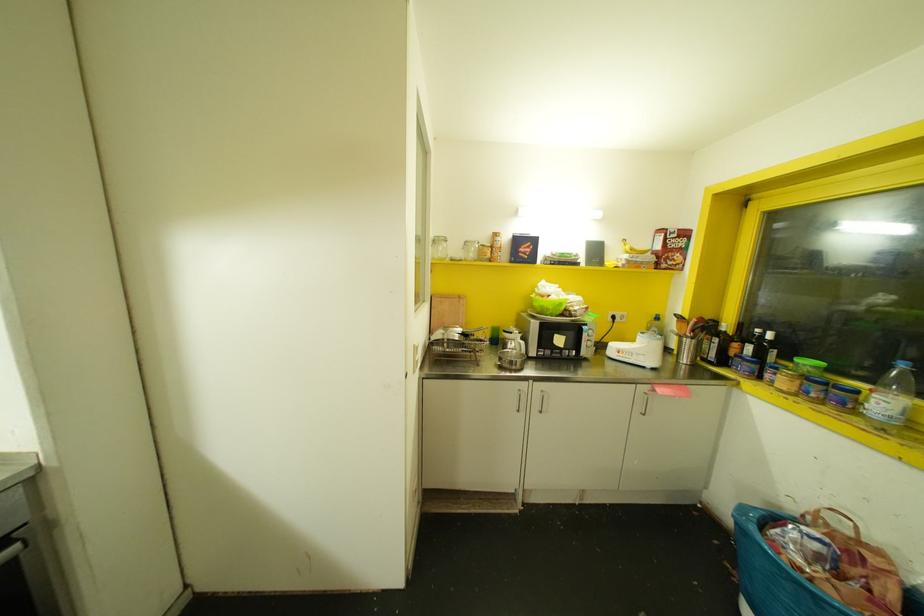
The width and height of the screenshot is (924, 616). Identify the location of blue bin handle. (752, 532).